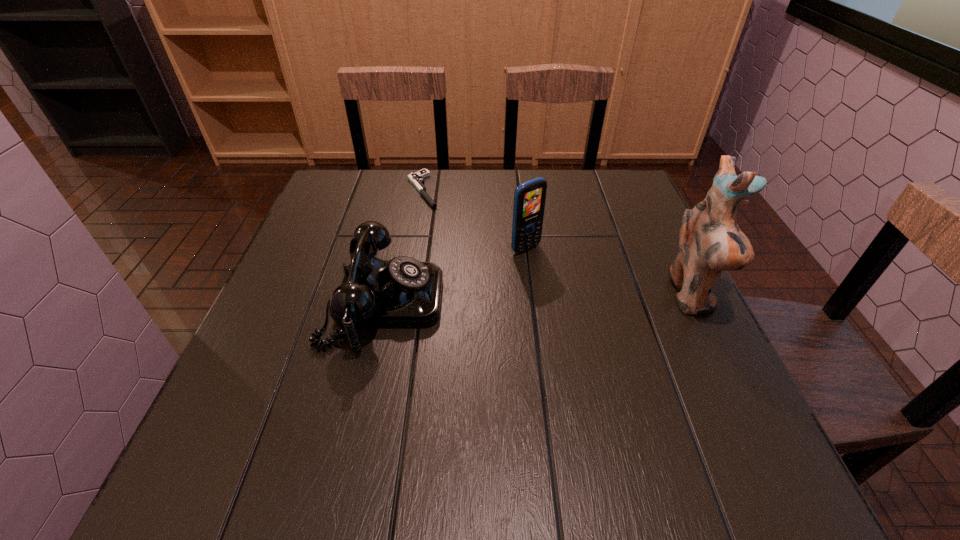
What are the coordinates of `vacant position located on the screen of the cellular telephone` in the screenshot? It's located at (609, 318).

Locate an element on the screen. The image size is (960, 540). blank space located 0.380m on the front-facing side of the farthest object is located at coordinates (500, 293).

Locate an element on the screen. This screenshot has width=960, height=540. vacant region located on the front-facing side of the farthest object is located at coordinates (487, 276).

The image size is (960, 540). In order to click on free space located on the front-facing side of the farthest object in this screenshot , I will do `click(439, 220)`.

Where is `object that is at the far edge`? object that is at the far edge is located at coordinates (417, 179).

The image size is (960, 540). In order to click on object that is at the left edge in this screenshot , I will do `click(403, 292)`.

At what (x,y) coordinates should I click in order to perform the action: click on object at the right edge. Please return your answer as a coordinate pair (x, y). Looking at the image, I should click on (710, 241).

Find the location of `free space at the far edge of the desktop`. free space at the far edge of the desktop is located at coordinates (544, 169).

This screenshot has width=960, height=540. In the image, there is a desktop. Find the location of `vacant space at the near edge`. vacant space at the near edge is located at coordinates (458, 428).

I want to click on vacant space at the left edge of the desktop, so click(344, 254).